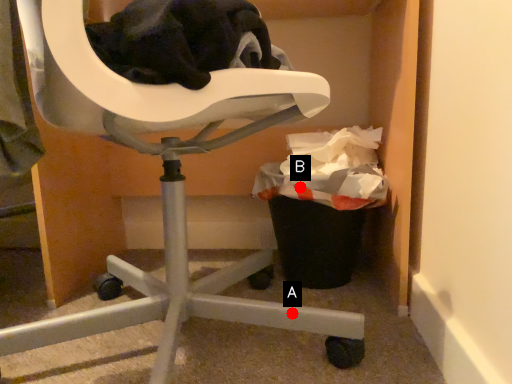
Question: Two points are circled on the image, labeled by A and B beside each circle. Among these points, which one is nearest to the camera?

Choices:
 (A) A is closer
 (B) B is closer

Answer: (A)